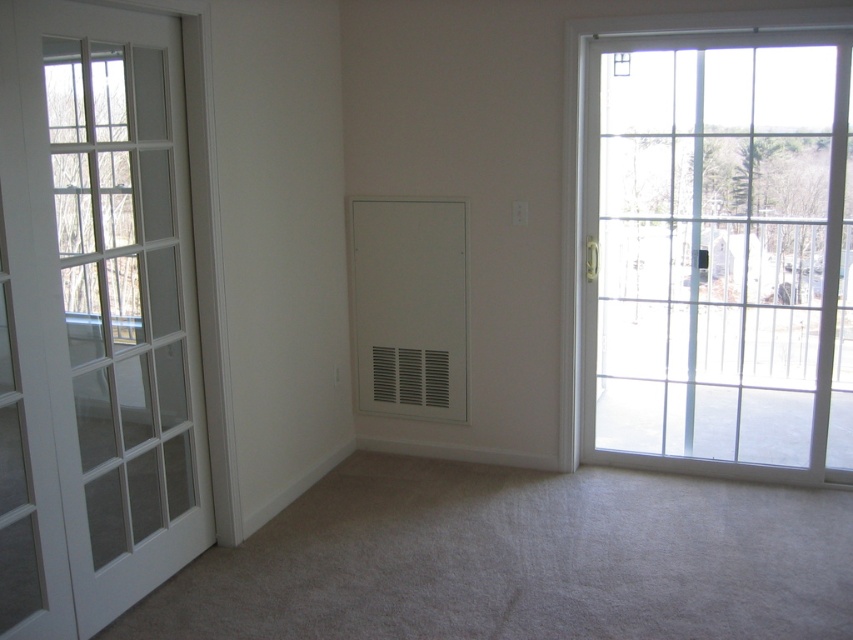
Question: Which of the following is the closest to the observer?

Choices:
 (A) (457, 364)
 (B) (49, 26)

Answer: (B)

Question: Which object appears farthest from the camera in this image?

Choices:
 (A) clear glass door at right
 (B) white matte vent at center

Answer: (B)

Question: Observing the image, what is the correct spatial positioning of white glass door at left in reference to white matte vent at center?

Choices:
 (A) below
 (B) above

Answer: (A)

Question: Is clear glass door at right smaller than white matte vent at center?

Choices:
 (A) yes
 (B) no

Answer: (B)

Question: Does clear glass door at right have a lesser width compared to white glass door at left?

Choices:
 (A) no
 (B) yes

Answer: (A)

Question: Which is nearer to the clear glass door at right?

Choices:
 (A) white matte vent at center
 (B) white glass door at left

Answer: (A)